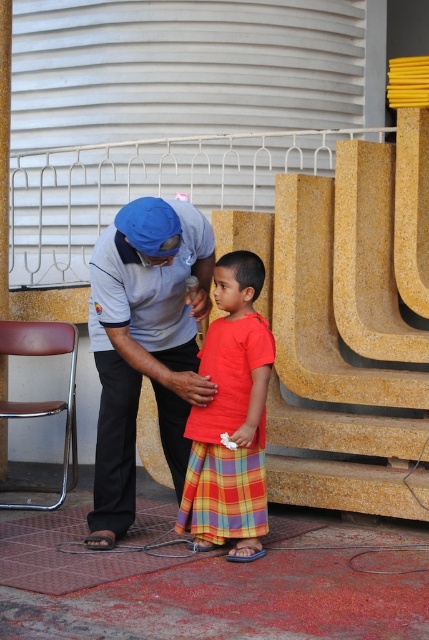
You are a photographer trying to capture a candid shot of the matte blue cap at center and the red plaid skirt at center. Since you want to ensure both subjects are in focus, you need to know their vertical positions. Which one is higher?

The matte blue cap at center is positioned over the red plaid skirt at center, so it is higher.

You are standing in front of the wall and want to place a small object on the closest point between point (111, 368) and point (233, 445). Which point should you choose?

You should choose point (111, 368) because it is closer to you than point (233, 445).